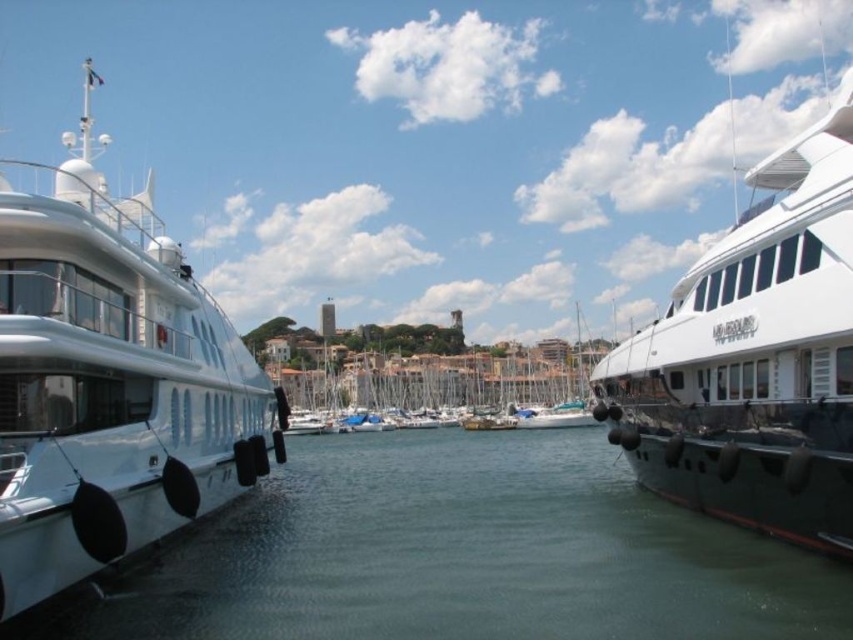
Does point (428, 496) come closer to viewer compared to point (103, 310)?

That is False.

Which is in front, point (451, 508) or point (142, 273)?

Point (142, 273) is in front.

Locate an element on the screen. This screenshot has width=853, height=640. clear water at center is located at coordinates (461, 554).